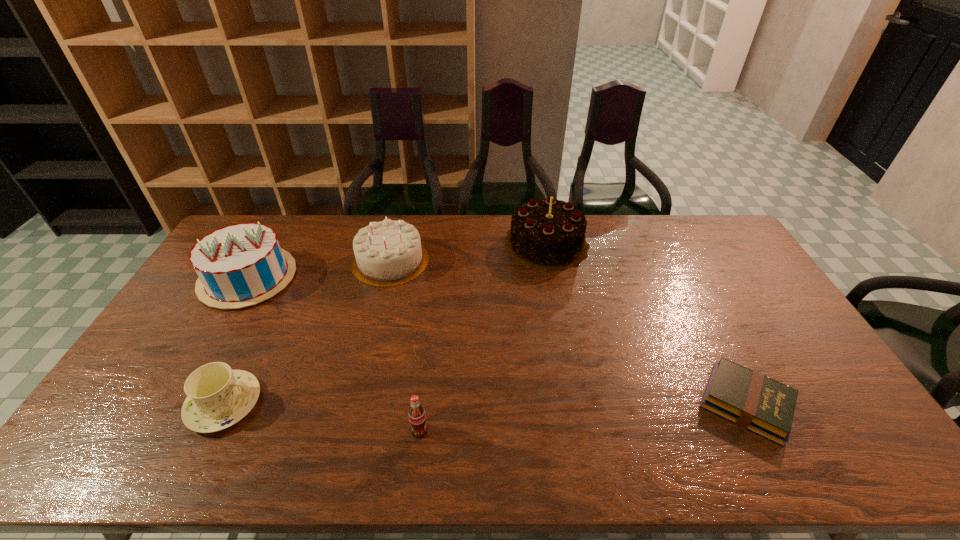
Identify the location of vacant space situated 0.150m on the right of the second birthday cake from right to left. This screenshot has height=540, width=960. (470, 261).

Identify the location of vacant space located 0.090m on the right of the fourth object from left to right. pyautogui.click(x=464, y=430).

I want to click on free space located 0.140m on the handle side of the chinaware, so click(x=313, y=403).

The image size is (960, 540). What are the coordinates of `vacant region located 0.070m on the back of the book` in the screenshot? It's located at (717, 347).

This screenshot has width=960, height=540. Find the location of `soda located in the near edge section of the desktop`. soda located in the near edge section of the desktop is located at coordinates (417, 417).

Image resolution: width=960 pixels, height=540 pixels. Identify the location of chinaware situated at the near edge. (218, 397).

The height and width of the screenshot is (540, 960). Identify the location of book at the near edge. (753, 401).

Identify the location of object that is at the left edge. This screenshot has width=960, height=540. (240, 265).

Find the location of `object that is positioned at the right edge`. object that is positioned at the right edge is located at coordinates (753, 401).

Image resolution: width=960 pixels, height=540 pixels. Identify the location of object located in the far left corner section of the desktop. pos(240,265).